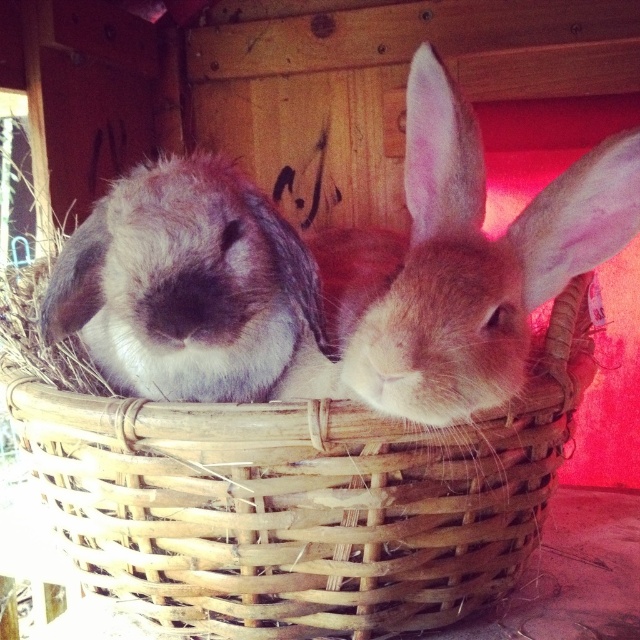
Can you confirm if woven wood basket at center is thinner than brown fur rabbit at center?

No, woven wood basket at center is not thinner than brown fur rabbit at center.

Where is `woven wood basket at center`? Image resolution: width=640 pixels, height=640 pixels. woven wood basket at center is located at coordinates (289, 490).

Which is more to the left, fuzzy brown rabbit at center or brown fur rabbit at center?

From the viewer's perspective, brown fur rabbit at center appears more on the left side.

Is point (413, 243) positioned after point (294, 289)?

Yes.

What are the coordinates of `fuzzy brown rabbit at center` in the screenshot? It's located at (465, 262).

Can you confirm if woven wood basket at center is positioned to the right of fuzzy brown rabbit at center?

In fact, woven wood basket at center is to the left of fuzzy brown rabbit at center.

Based on the photo, is woven wood basket at center thinner than fuzzy brown rabbit at center?

In fact, woven wood basket at center might be wider than fuzzy brown rabbit at center.

At what (x,y) coordinates should I click in order to perform the action: click on woven wood basket at center. Please return your answer as a coordinate pair (x, y). Image resolution: width=640 pixels, height=640 pixels. Looking at the image, I should click on (289, 490).